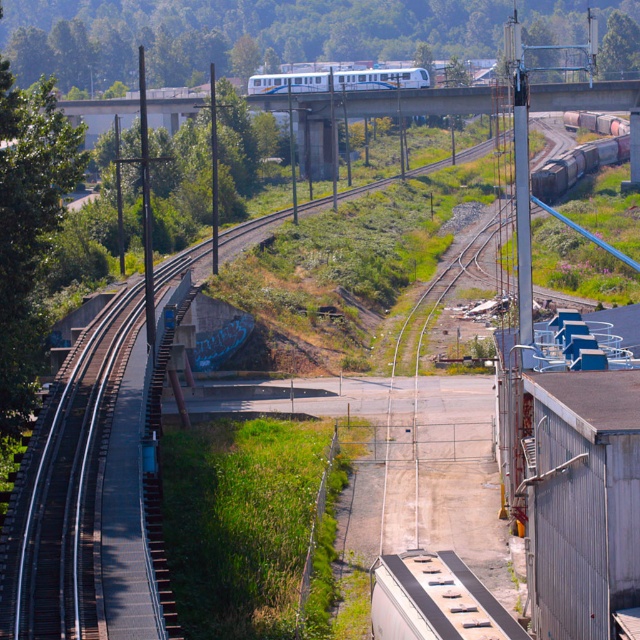
Which of these two, rusty metal train car at right or white glossy passenger train at upper center, stands taller?

rusty metal train car at right

Is rusty metal train car at right closer to the viewer compared to white glossy passenger train at upper center?

That is True.

Find the location of `rusty metal train car at right`. rusty metal train car at right is located at coordinates (580, 156).